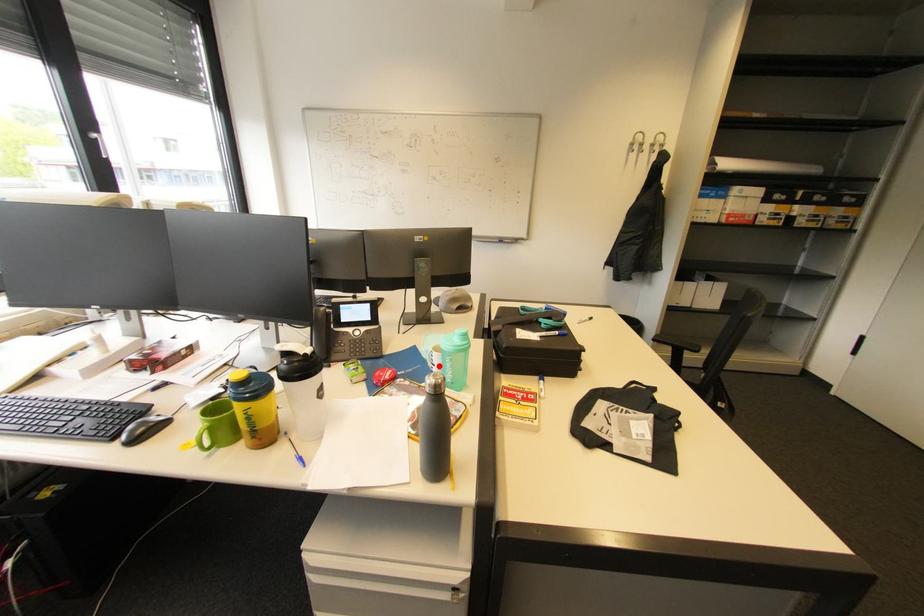
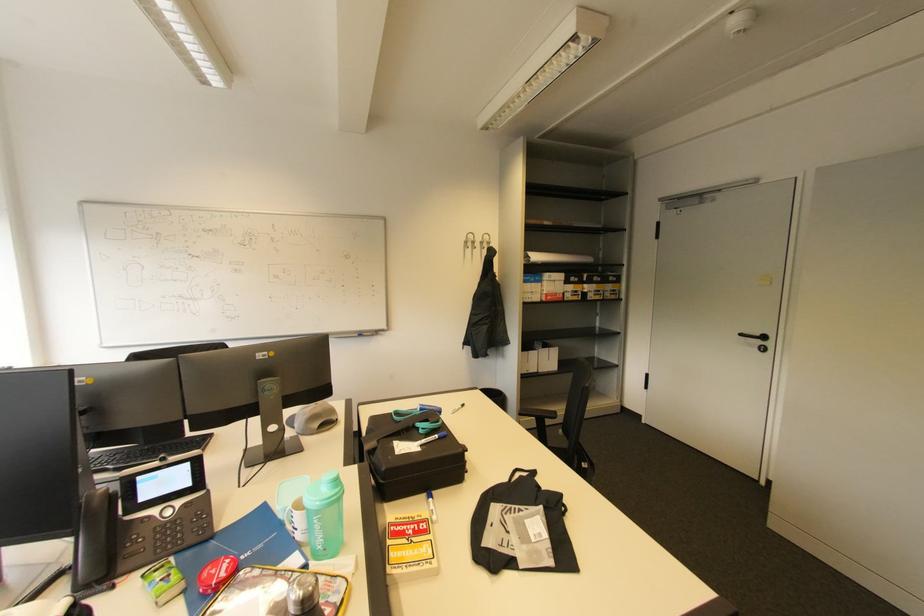
Where in the second image is the point corresponding to the highlighted location from the first image?

(300, 531)